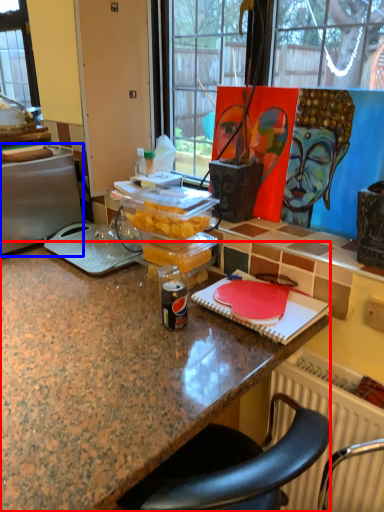
Question: Which object appears farthest to the camera in this image, desk (highlighted by a red box) or appliance (highlighted by a blue box)?

Choices:
 (A) desk
 (B) appliance

Answer: (B)